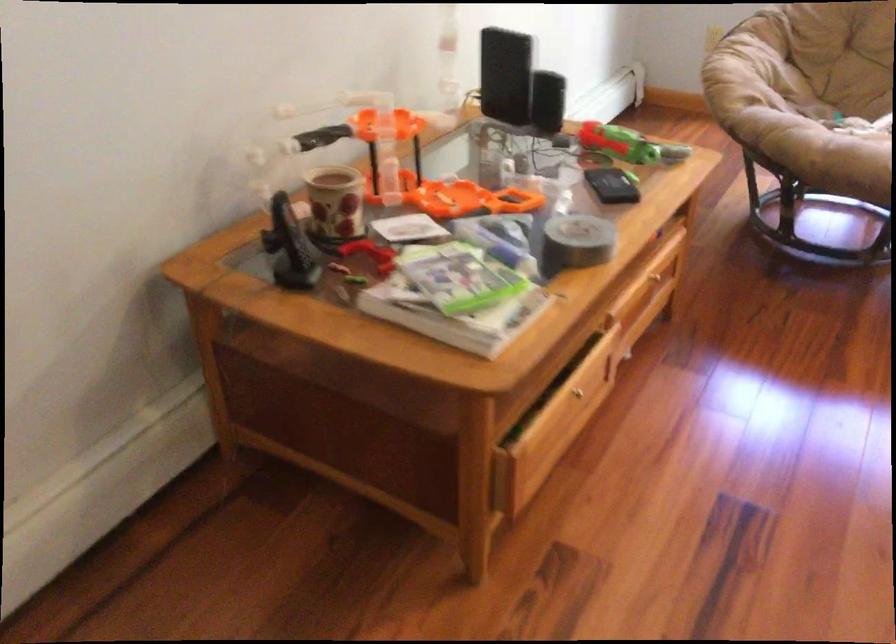
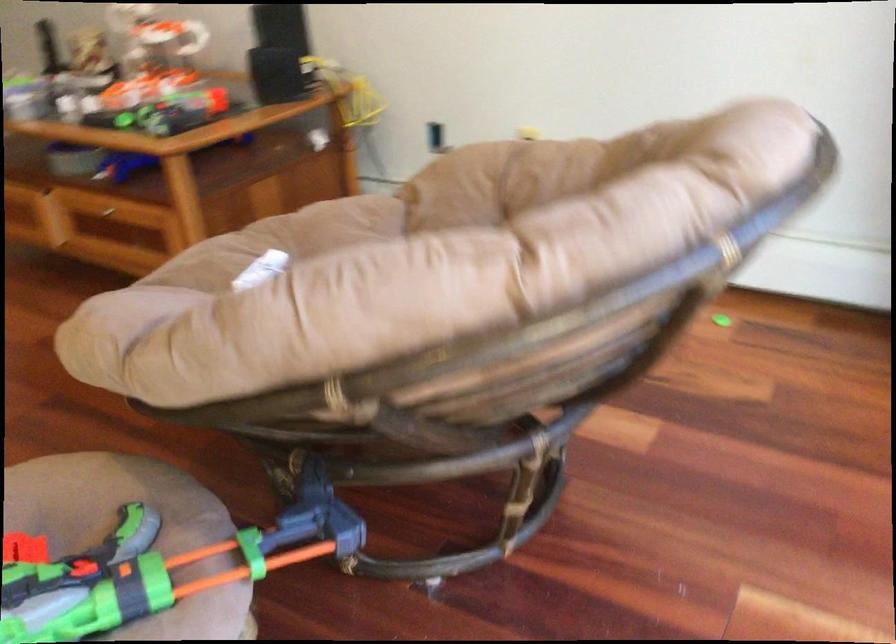
In the second image, find the point that corresponds to pixel 666 270 in the first image.

(107, 213)